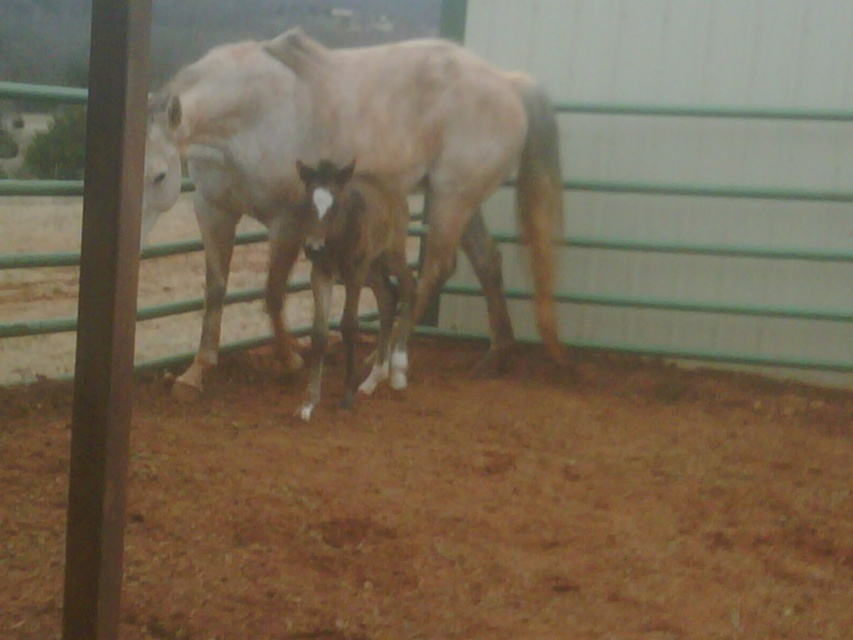
Does white matte horse at center appear over dark brown glossy horse at center?

Indeed, white matte horse at center is positioned over dark brown glossy horse at center.

Between point (358, 97) and point (312, 253), which one is positioned in front?

Positioned in front is point (312, 253).

In the scene shown: Who is more forward, (270, 262) or (369, 227)?

Point (369, 227)

The height and width of the screenshot is (640, 853). I want to click on white matte horse at center, so click(357, 161).